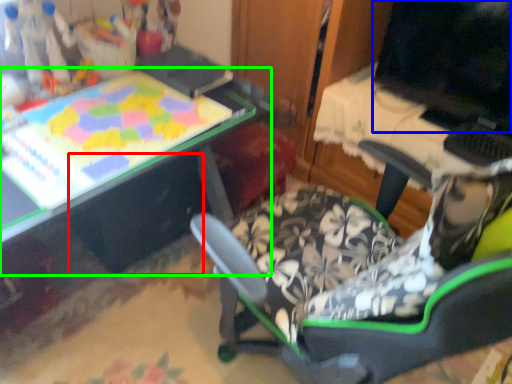
Question: Estimate the real-world distances between objects in this image. Which object is farther from drawer (highlighted by a red box), computer monitor (highlighted by a blue box) or table (highlighted by a green box)?

Choices:
 (A) computer monitor
 (B) table

Answer: (A)